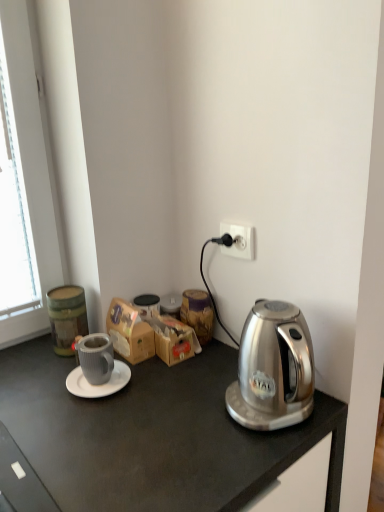
This screenshot has width=384, height=512. What do you see at coordinates (173, 340) in the screenshot?
I see `brown cardboard box at center` at bounding box center [173, 340].

Image resolution: width=384 pixels, height=512 pixels. I want to click on brown cardboard box at center, so click(x=173, y=340).

What is the approximate height of white matte saucer at center?

white matte saucer at center is 0.73 inches tall.

The height and width of the screenshot is (512, 384). Describe the element at coordinates (198, 313) in the screenshot. I see `wooden jar at center` at that location.

What is the approximate width of wooden jar at center?

wooden jar at center is 3.15 inches wide.

Image resolution: width=384 pixels, height=512 pixels. What are the coordinates of `matte gray mug at center left` in the screenshot? It's located at (96, 357).

Between white plastic power outlet at upper right and wooden jar at center, which one has smaller size?

white plastic power outlet at upper right is smaller.

Is white plastic power outlet at upper right inside or outside of wooden jar at center?

white plastic power outlet at upper right lies outside wooden jar at center.

From a real-world perspective, is white plastic power outlet at upper right on top of wooden jar at center?

Yes, from a real-world perspective, white plastic power outlet at upper right is over wooden jar at center

Can you confirm if matte gray mug at center left is smaller than white matte saucer at center?

No, matte gray mug at center left is not smaller than white matte saucer at center.

From the image's perspective, which object appears higher, matte gray mug at center left or white matte saucer at center?

matte gray mug at center left, from the image's perspective.

Is point (89, 351) closer to viewer compared to point (114, 370)?

Yes.

What's the angular difference between matte gray mug at center left and white matte saucer at center's facing directions?

0.74 degrees.

In the scene shown: Can you confirm if white plastic power outlet at upper right is taller than brown cardboard box at center?

Incorrect, the height of white plastic power outlet at upper right is not larger of that of brown cardboard box at center.

Would you say white plastic power outlet at upper right contains brown cardboard box at center?

No, brown cardboard box at center is not a part of white plastic power outlet at upper right.

Are white plastic power outlet at upper right and brown cardboard box at center making contact?

No, white plastic power outlet at upper right is not beside brown cardboard box at center.

Does white plastic power outlet at upper right have a smaller size compared to brown cardboard box at center?

Yes, white plastic power outlet at upper right is smaller than brown cardboard box at center.

Between white matte saucer at center and white plastic power outlet at upper right, which one appears on the left side from the viewer's perspective?

white matte saucer at center is more to the left.

From the image's perspective, relative to white plastic power outlet at upper right, is white matte saucer at center above or below?

From the image's perspective, white matte saucer at center appears below white plastic power outlet at upper right.

Which of these two, white matte saucer at center or white plastic power outlet at upper right, is thinner?

white plastic power outlet at upper right.

Is white plastic power outlet at upper right a part of white matte saucer at center?

Definitely not — white plastic power outlet at upper right is not inside white matte saucer at center.

I want to click on power outlet in front of the wooden jar at center, so click(238, 241).

Can we say wooden jar at center lies outside white plastic power outlet at upper right?

Yes, wooden jar at center is not within white plastic power outlet at upper right.

Is the depth of wooden jar at center less than that of white plastic power outlet at upper right?

No, wooden jar at center is further to the viewer.

Looking at this image, which of these two, wooden jar at center or white plastic power outlet at upper right, is bigger?

wooden jar at center.

Is white matte saucer at center situated inside matte gray mug at center left or outside?

white matte saucer at center is located beyond the bounds of matte gray mug at center left.

Find the location of a particular element. Image resolution: width=384 pixels, height=512 pixels. coffee cup in front of the white matte saucer at center is located at coordinates (96, 357).

In terms of width, does white matte saucer at center look wider or thinner when compared to matte gray mug at center left?

In the image, white matte saucer at center appears to be wider than matte gray mug at center left.

Can you tell me how much white matte saucer at center and matte gray mug at center left differ in facing direction?

white matte saucer at center and matte gray mug at center left are facing 0.74 degrees away from each other.

From the image's perspective, which is above, matte gray mug at center left or brown cardboard box at center?

brown cardboard box at center appears higher in the image.

Considering the positions of objects matte gray mug at center left and brown cardboard box at center in the image provided, who is behind, matte gray mug at center left or brown cardboard box at center?

brown cardboard box at center is further away from the camera.

Where is `coffee cup below the brown cardboard box at center (from the image's perspective)`? The image size is (384, 512). coffee cup below the brown cardboard box at center (from the image's perspective) is located at coordinates (96, 357).

Which object is wider, matte gray mug at center left or brown cardboard box at center?

matte gray mug at center left.

This screenshot has height=512, width=384. In order to click on power outlet on the right of wooden jar at center in this screenshot , I will do `click(238, 241)`.

Where is `coffee cup above the white matte saucer at center (from a real-world perspective)`? Image resolution: width=384 pixels, height=512 pixels. coffee cup above the white matte saucer at center (from a real-world perspective) is located at coordinates (96, 357).

From the image, which object appears to be nearer to brown cardboard box at center, white matte saucer at center or matte gray mug at center left?

The object closer to brown cardboard box at center is white matte saucer at center.

When comparing their distances from wooden jar at center, does matte gray mug at center left or brown cardboard box at center seem further?

matte gray mug at center left.

Based on their spatial positions, is brown cardboard box at center or white plastic power outlet at upper right closer to matte gray mug at center left?

Among the two, brown cardboard box at center is located nearer to matte gray mug at center left.

In the scene shown: Based on their spatial positions, is brown cardboard box at center or wooden jar at center further from white plastic power outlet at upper right?

The object further to white plastic power outlet at upper right is brown cardboard box at center.

Looking at the image, which one is located further to brown cardboard box at center, white plastic power outlet at upper right or matte gray mug at center left?

white plastic power outlet at upper right is further to brown cardboard box at center.

Looking at the image, which one is located closer to wooden jar at center, white plastic power outlet at upper right or matte gray mug at center left?

white plastic power outlet at upper right is closer to wooden jar at center.

Considering their positions, is brown cardboard box at center positioned closer to white matte saucer at center than white plastic power outlet at upper right?

The object closer to white matte saucer at center is brown cardboard box at center.

From the image, which object appears to be farther from white plastic power outlet at upper right, brown cardboard box at center or matte gray mug at center left?

The object further to white plastic power outlet at upper right is matte gray mug at center left.

This screenshot has width=384, height=512. I want to click on cardboard box between white matte saucer at center and wooden jar at center in the horizontal direction, so click(173, 340).

Where is `appliance that lies between white plastic power outlet at upper right and white matte saucer at center from top to bottom`? appliance that lies between white plastic power outlet at upper right and white matte saucer at center from top to bottom is located at coordinates (198, 313).

Find the location of `coffee cup between white matte saucer at center and wooden jar at center in the horizontal direction`. coffee cup between white matte saucer at center and wooden jar at center in the horizontal direction is located at coordinates (96, 357).

Locate an element on the screen. The width and height of the screenshot is (384, 512). appliance between white plastic power outlet at upper right and brown cardboard box at center vertically is located at coordinates (198, 313).